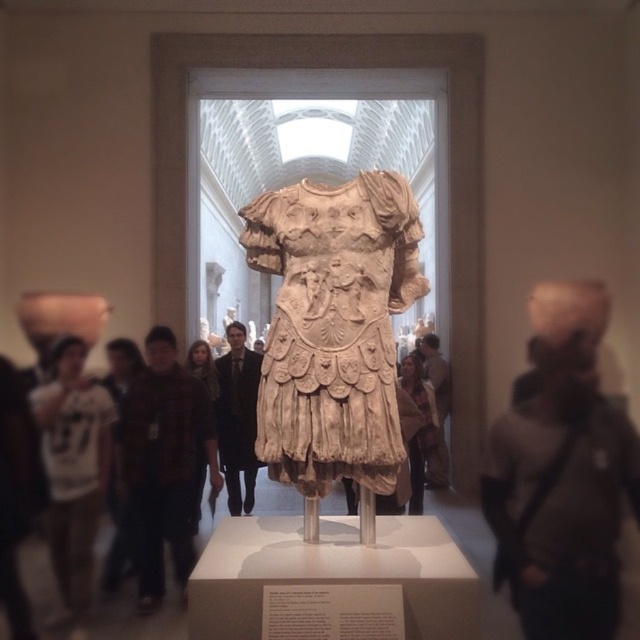
This screenshot has width=640, height=640. Describe the element at coordinates (333, 332) in the screenshot. I see `beige stone armor at center` at that location.

Between point (321, 481) and point (67, 346), which one is positioned behind?

Positioned behind is point (67, 346).

This screenshot has width=640, height=640. I want to click on beige stone armor at center, so click(333, 332).

Find the location of a particular element. This screenshot has height=640, width=640. beige stone armor at center is located at coordinates pyautogui.click(x=333, y=332).

Where is `matte gray shirt at center`? matte gray shirt at center is located at coordinates (563, 474).

From the picture: Who is more forward, (182, 566) or (188, 364)?

Positioned in front is point (182, 566).

Can you confirm if brown wool sweater at center is shorter than brown wool scarf at center?

Incorrect, brown wool sweater at center's height does not fall short of brown wool scarf at center's.

The image size is (640, 640). I want to click on brown wool sweater at center, so click(163, 461).